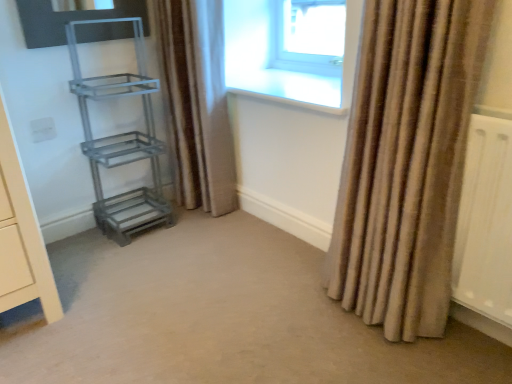
Question: Should I look upward or downward to see transparent glass window at upper center?

Choices:
 (A) down
 (B) up

Answer: (B)

Question: Considering the relative positions of metallic gray shelf at left, which ranks as the 1th shelf in top-to-bottom order, and beige textured curtain at right, which ranks as the first curtain in front-to-back order, in the image provided, is metallic gray shelf at left, which ranks as the 1th shelf in top-to-bottom order, to the left of beige textured curtain at right, which ranks as the first curtain in front-to-back order, from the viewer's perspective?

Choices:
 (A) no
 (B) yes

Answer: (B)

Question: Are metallic gray shelf at left, which is counted as the 2th shelf, starting from the bottom, and beige textured curtain at right, which ranks as the first curtain in front-to-back order, far apart?

Choices:
 (A) no
 (B) yes

Answer: (B)

Question: Considering the relative positions of metallic gray shelf at left, which ranks as the 1th shelf in top-to-bottom order, and beige textured curtain at right, which ranks as the first curtain in front-to-back order, in the image provided, is metallic gray shelf at left, which ranks as the 1th shelf in top-to-bottom order, in front of beige textured curtain at right, which ranks as the first curtain in front-to-back order,?

Choices:
 (A) no
 (B) yes

Answer: (A)

Question: Is metallic gray shelf at left, which ranks as the 1th shelf in top-to-bottom order, behind beige textured curtain at right, which ranks as the first curtain in front-to-back order?

Choices:
 (A) yes
 (B) no

Answer: (A)

Question: Can you confirm if metallic gray shelf at left, which is counted as the 2th shelf, starting from the bottom, is shorter than beige textured curtain at right, which appears as the second curtain when viewed from the back?

Choices:
 (A) no
 (B) yes

Answer: (B)

Question: From a real-world perspective, is metallic gray shelf at left, which ranks as the 1th shelf in top-to-bottom order, located beneath beige textured curtain at right, which appears as the 2th curtain when viewed from the left?

Choices:
 (A) yes
 (B) no

Answer: (A)

Question: Considering the relative sizes of transparent glass window at upper center and carpet at center in the image provided, is transparent glass window at upper center taller than carpet at center?

Choices:
 (A) no
 (B) yes

Answer: (B)

Question: Is transparent glass window at upper center smaller than carpet at center?

Choices:
 (A) yes
 (B) no

Answer: (A)

Question: Can you confirm if transparent glass window at upper center is positioned to the left of carpet at center?

Choices:
 (A) yes
 (B) no

Answer: (B)

Question: Does transparent glass window at upper center have a lesser width compared to carpet at center?

Choices:
 (A) yes
 (B) no

Answer: (A)

Question: Would you consider transparent glass window at upper center to be distant from carpet at center?

Choices:
 (A) no
 (B) yes

Answer: (B)

Question: Is transparent glass window at upper center bigger than carpet at center?

Choices:
 (A) yes
 (B) no

Answer: (B)

Question: Does metallic gray shelf at lower left, which ranks as the second shelf in top-to-bottom order, turn towards metallic gray shelf at left, which ranks as the 1th shelf in top-to-bottom order?

Choices:
 (A) yes
 (B) no

Answer: (A)